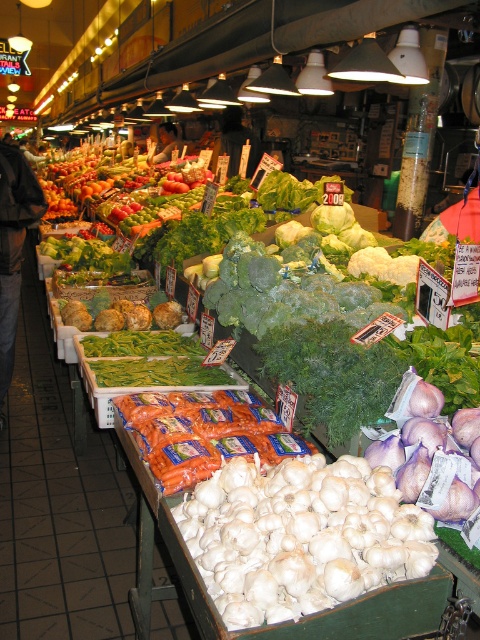
Question: Is white matte garlic at lower center thinner than smooth skin face at center?

Choices:
 (A) yes
 (B) no

Answer: (B)

Question: Which point appears closest to the camera in this image?

Choices:
 (A) (2, 186)
 (B) (158, 412)

Answer: (B)

Question: Which of the following is the farthest from the observer?

Choices:
 (A) (3, 298)
 (B) (159, 138)
 (C) (176, 406)

Answer: (B)

Question: Does orange plastic carrots at center have a lesser width compared to smooth skin face at center?

Choices:
 (A) yes
 (B) no

Answer: (B)

Question: Among these objects, which one is nearest to the camera?

Choices:
 (A) dark blue jeans at lower left
 (B) orange plastic carrots at center
 (C) white matte garlic at lower center
 (D) smooth skin face at center

Answer: (C)

Question: Does orange plastic carrots at center appear on the right side of dark blue jeans at lower left?

Choices:
 (A) yes
 (B) no

Answer: (A)